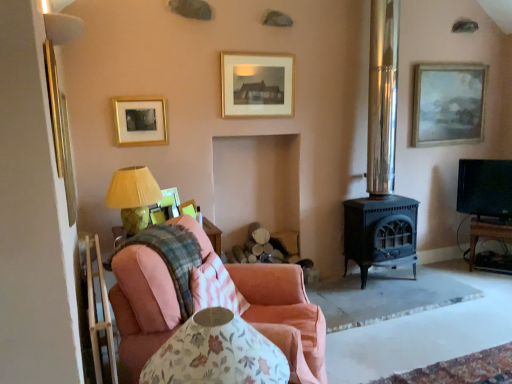
Question: From a real-world perspective, is pink fabric couch at lower left above or below matte yellow fabric at left?

Choices:
 (A) below
 (B) above

Answer: (A)

Question: In terms of width, does pink fabric couch at lower left look wider or thinner when compared to matte yellow fabric at left?

Choices:
 (A) thin
 (B) wide

Answer: (B)

Question: Which of these objects is positioned closest to the black glossy tv at right?

Choices:
 (A) pink cotton pillow at center
 (B) polished metal stove at center-right
 (C) gold-framed print at upper center, the 2th picture frame in the back-to-front sequence
 (D) metallic gold picture frame at left, the first picture frame positioned from the left
 (E) gold/glossy picture frame at upper left, the second picture frame positioned from the left

Answer: (B)

Question: Which object is positioned farthest from the pink fabric couch at lower left?

Choices:
 (A) gold/glossy picture frame at upper left, which is the 3th picture frame from front to back
 (B) polished metal stove at center-right
 (C) matte yellow fabric at left
 (D) pink cotton pillow at center
 (E) pink fabric chair at lower left

Answer: (B)